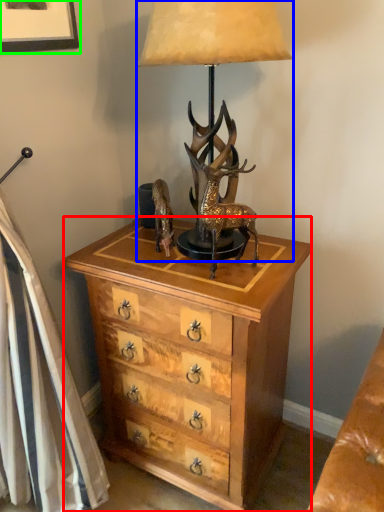
Question: Which is farther away from chest of drawers (highlighted by a red box)? lamp (highlighted by a blue box) or picture frame (highlighted by a green box)?

Choices:
 (A) lamp
 (B) picture frame

Answer: (B)